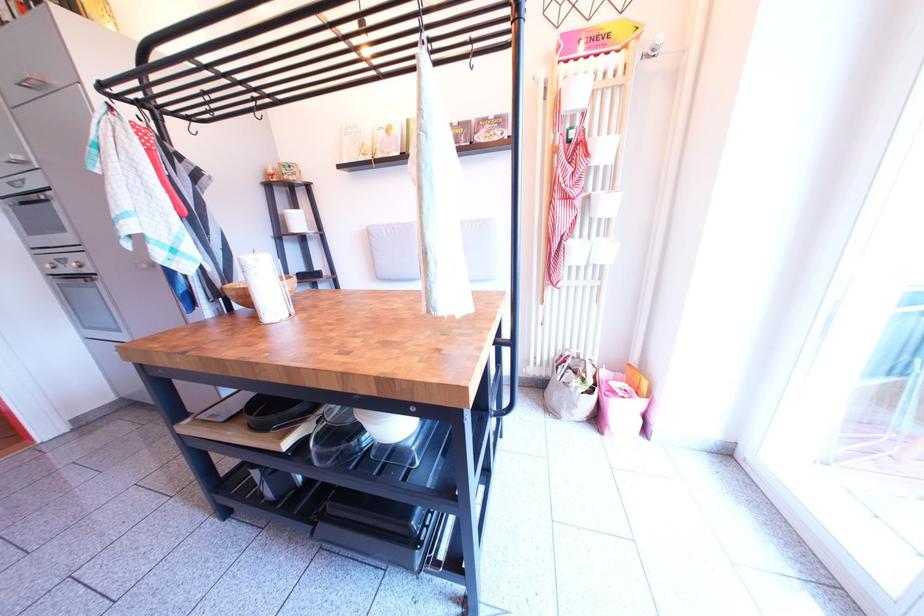
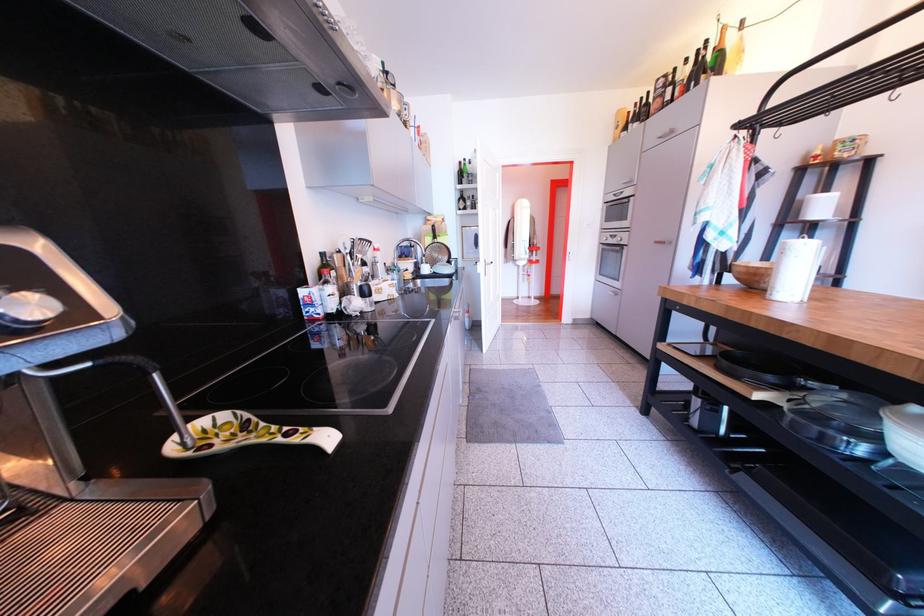
In the second image, find the point that corresponds to (x=74, y=267) in the first image.

(624, 243)